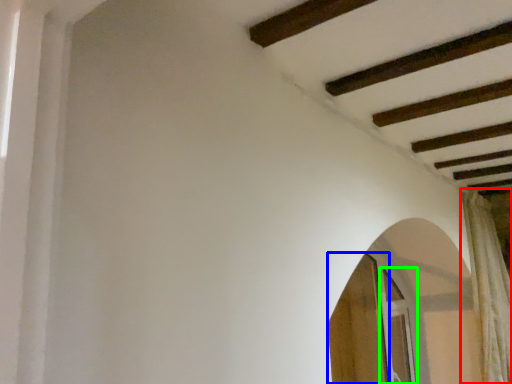
Question: Which object is positioned closest to curtain (highlighted by a red box)? Select from screen door (highlighted by a blue box) and screen door (highlighted by a green box).

Choices:
 (A) screen door
 (B) screen door

Answer: (B)